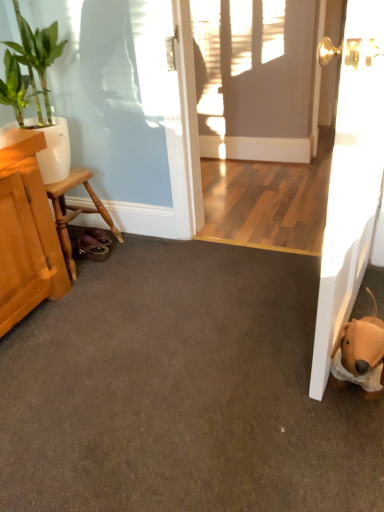
What do you see at coordinates (75, 210) in the screenshot?
I see `wooden stool at left` at bounding box center [75, 210].

In order to click on wooden stool at left in this screenshot , I will do `click(75, 210)`.

How far apart are green glossy plant at upper left and brown plush dog at lower right?

green glossy plant at upper left is 1.40 meters from brown plush dog at lower right.

Is green glossy plant at upper left to the left of brown plush dog at lower right from the viewer's perspective?

→ Yes.

Considering the sizes of objects green glossy plant at upper left and brown plush dog at lower right in the image provided, who is wider, green glossy plant at upper left or brown plush dog at lower right?

Wider between the two is green glossy plant at upper left.

Between white glossy door at right and green glossy plant at upper left, which one has smaller size?

white glossy door at right is smaller.

Is white glossy door at right wider than green glossy plant at upper left?

Yes.

From the image's perspective, which one is positioned higher, white glossy door at right or green glossy plant at upper left?

green glossy plant at upper left.

Is white glossy door at right taller or shorter than green glossy plant at upper left?

Clearly, white glossy door at right is taller compared to green glossy plant at upper left.

From a real-world perspective, is white glossy door at right located higher than brown plush dog at lower right?

Correct, in the physical world, white glossy door at right is higher than brown plush dog at lower right.

Considering the relative sizes of white glossy door at right and brown plush dog at lower right in the image provided, is white glossy door at right shorter than brown plush dog at lower right?

No.

Which is closer, (342, 125) or (381, 388)?

Point (342, 125) is closer to the camera than point (381, 388).

Between point (74, 168) and point (344, 218), which one is positioned in front?

The point (344, 218) is closer.

Locate an element on the screen. The image size is (384, 512). furniture below the white glossy door at right (from the image's perspective) is located at coordinates (75, 210).

Considering the relative positions of wooden stool at left and white glossy door at right in the image provided, is wooden stool at left to the left or to the right of white glossy door at right?

From the image, it's evident that wooden stool at left is to the left of white glossy door at right.

From the picture: From a real-world perspective, is wooden stool at left physically below white glossy door at right?

Yes, from a real-world perspective, wooden stool at left is beneath white glossy door at right.

Which is behind, point (36, 54) or point (60, 227)?

The point (60, 227) is farther from the camera.

Does green glossy plant at upper left have a smaller size compared to wooden stool at left?

No, green glossy plant at upper left is not smaller than wooden stool at left.

Choose the correct answer: Is green glossy plant at upper left inside wooden stool at left or outside it?

green glossy plant at upper left is outside wooden stool at left.

From the image's perspective, is green glossy plant at upper left located beneath wooden stool at left?

Actually, green glossy plant at upper left appears above wooden stool at left in the image.

Who is smaller, brown plush dog at lower right or white glossy door at right?

With smaller size is brown plush dog at lower right.

Considering the sizes of objects brown plush dog at lower right and white glossy door at right in the image provided, who is thinner, brown plush dog at lower right or white glossy door at right?

With smaller width is brown plush dog at lower right.

Locate an element on the screen. animal located on the left of white glossy door at right is located at coordinates (360, 354).

Consider the image. Is white glossy door at right positioned beyond the bounds of wooden stool at left?

Yes.

Between white glossy door at right and wooden stool at left, which one has less height?

wooden stool at left is shorter.

At what (x,y) coordinates should I click in order to perform the action: click on furniture below the white glossy door at right (from the image's perspective). Please return your answer as a coordinate pair (x, y). Image resolution: width=384 pixels, height=512 pixels. Looking at the image, I should click on (75, 210).

Between white glossy door at right and wooden stool at left, which one has larger size?

Bigger between the two is white glossy door at right.

Identify the location of animal located below the green glossy plant at upper left (from the image's perspective). (360, 354).

What are the coordinates of `door that appears on the right of green glossy plant at upper left` in the screenshot? It's located at (351, 183).

Based on their spatial positions, is white glossy door at right or green glossy plant at upper left closer to brown plush dog at lower right?

Among the two, white glossy door at right is located nearer to brown plush dog at lower right.

Based on their spatial positions, is brown plush dog at lower right or wooden stool at left closer to green glossy plant at upper left?

Among the two, wooden stool at left is located nearer to green glossy plant at upper left.

Considering their positions, is wooden stool at left positioned further to white glossy door at right than brown plush dog at lower right?

Among the two, wooden stool at left is located further to white glossy door at right.

When comparing their distances from brown plush dog at lower right, does wooden stool at left or white glossy door at right seem further?

Based on the image, wooden stool at left appears to be further to brown plush dog at lower right.

When comparing their distances from wooden stool at left, does brown plush dog at lower right or white glossy door at right seem further?

brown plush dog at lower right is positioned further to the anchor wooden stool at left.

From the image, which object appears to be farther from green glossy plant at upper left, wooden stool at left or brown plush dog at lower right?

Based on the image, brown plush dog at lower right appears to be further to green glossy plant at upper left.

Considering their positions, is brown plush dog at lower right positioned further to wooden stool at left than green glossy plant at upper left?

The object further to wooden stool at left is brown plush dog at lower right.

Which object lies further to the anchor point brown plush dog at lower right, green glossy plant at upper left or white glossy door at right?

green glossy plant at upper left.

At what (x,y) coordinates should I click in order to perform the action: click on furniture between green glossy plant at upper left and brown plush dog at lower right from left to right. Please return your answer as a coordinate pair (x, y). Image resolution: width=384 pixels, height=512 pixels. Looking at the image, I should click on (75, 210).

This screenshot has width=384, height=512. What are the coordinates of `furniture located between green glossy plant at upper left and white glossy door at right in the left-right direction` in the screenshot? It's located at (75, 210).

This screenshot has width=384, height=512. Find the location of `animal between wooden stool at left and white glossy door at right in the horizontal direction`. animal between wooden stool at left and white glossy door at right in the horizontal direction is located at coordinates (360, 354).

Where is `animal between green glossy plant at upper left and white glossy door at right in the horizontal direction`? The image size is (384, 512). animal between green glossy plant at upper left and white glossy door at right in the horizontal direction is located at coordinates (360, 354).